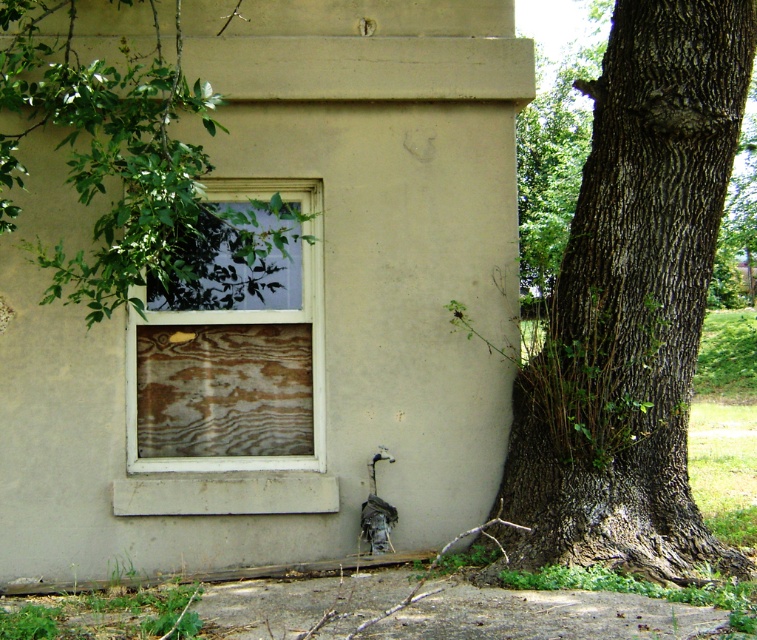
Looking at this image, you are a painter trying to decide where to place your easel. You want to paint both the dark brown textured bark at right and the wooden panel at center. Which object should you stand closer to in order to capture both in your painting?

You should stand closer to the wooden panel at center because the dark brown textured bark at right might be wider than the wooden panel at center, so being closer to the panel allows you to include both in your composition without cropping the wider bark.

You are a painter standing at the corner of the building. You need to paint the wooden panel at center and the dark brown textured bark at right. Which one should you paint first if you want to start with the object that is higher up?

The dark brown textured bark at right is positioned over the wooden panel at center, so you should paint the dark brown textured bark at right first since it is higher up.